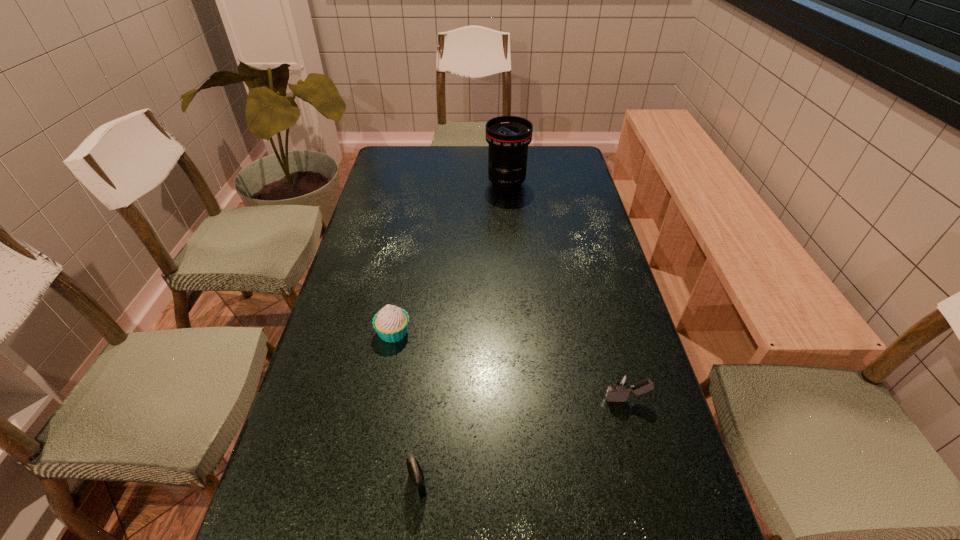
Where is `the third object from left to right`? the third object from left to right is located at coordinates (508, 137).

Identify the location of the tallest object. The image size is (960, 540). (508, 137).

I want to click on the second farthest object, so click(x=391, y=323).

The width and height of the screenshot is (960, 540). Identify the location of cupcake. (391, 323).

Where is `igniter`? igniter is located at coordinates (x=621, y=385).

Identify the location of the third farthest object. The height and width of the screenshot is (540, 960). (621, 385).

The width and height of the screenshot is (960, 540). What are the coordinates of `padlock` in the screenshot? It's located at pos(416,476).

You are a GUI agent. You are given a task and a screenshot of the screen. Output one action in this format:
    pyautogui.click(x=<x>, y=<y>)
    Task: Click on the nearest object
    The image size is (960, 540).
    Given the screenshot: What is the action you would take?
    pyautogui.click(x=416, y=476)

I want to click on vacant area located 0.110m on the right of the farthest object, so click(x=558, y=184).

At what (x,y) coordinates should I click in order to perform the action: click on vacant space situated 0.270m on the back of the cupcake. Please return your answer as a coordinate pair (x, y). Looking at the image, I should click on (408, 253).